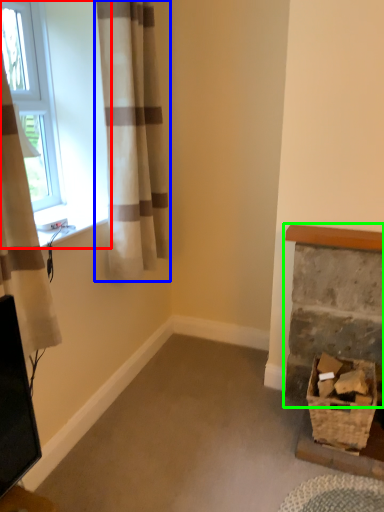
Question: Which is farther away from window (highlighted by a red box)? curtain (highlighted by a blue box) or fireplace (highlighted by a green box)?

Choices:
 (A) curtain
 (B) fireplace

Answer: (B)